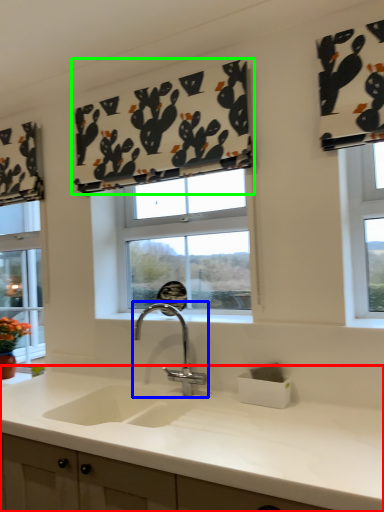
Question: Which object is positioned closest to countertop (highlighted by a red box)? Select from tap (highlighted by a blue box) and curtain (highlighted by a green box).

Choices:
 (A) tap
 (B) curtain

Answer: (A)